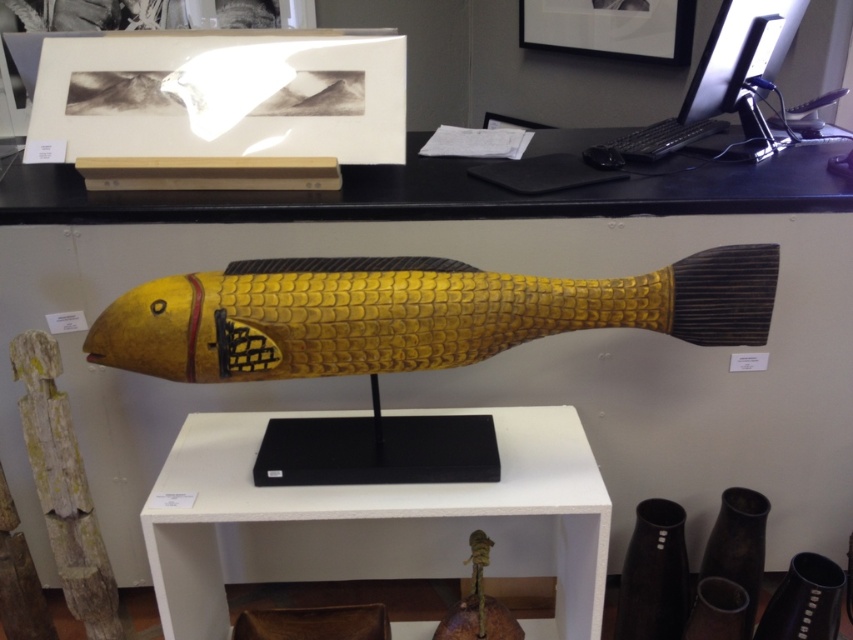
Is point (683, 298) in front of point (660, 154)?

Yes.

Which is behind, point (178, 365) or point (721, 108)?

Positioned behind is point (721, 108).

Who is more distant from viewer, [148,300] or [735,56]?

The point [735,56] is behind.

This screenshot has height=640, width=853. In order to click on yellow wood fish at center in this screenshot , I will do `click(415, 316)`.

Is white matte shelf at center further to camera compared to yellow wood fish at center?

Yes, it is.

Can you confirm if white matte shelf at center is positioned below yellow wood fish at center?

Indeed, white matte shelf at center is positioned under yellow wood fish at center.

Locate an element on the screen. The image size is (853, 640). white matte shelf at center is located at coordinates (374, 518).

Locate an element on the screen. The image size is (853, 640). white matte shelf at center is located at coordinates (374, 518).

Is white matte shelf at center positioned at the back of black plastic monitor at upper right?

No.

Does white matte shelf at center have a greater width compared to black plastic monitor at upper right?

Yes, white matte shelf at center is wider than black plastic monitor at upper right.

Does point (381, 536) come closer to viewer compared to point (788, 33)?

Yes, point (381, 536) is in front of point (788, 33).

Locate an element on the screen. Image resolution: width=853 pixels, height=640 pixels. white matte shelf at center is located at coordinates [374, 518].